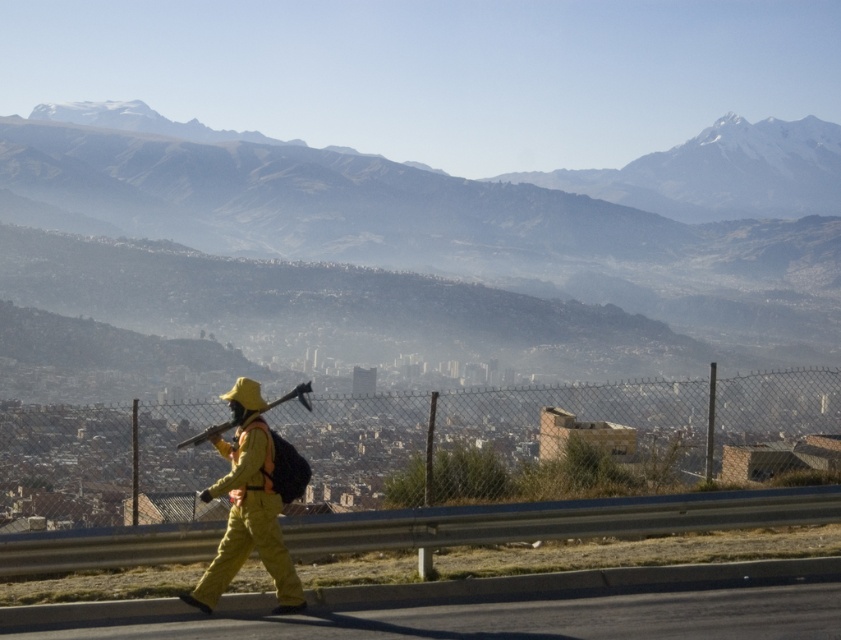
Question: Is black asphalt highway at lower center positioned behind matte black ax at center?

Choices:
 (A) yes
 (B) no

Answer: (B)

Question: Which point appears farthest from the camera in this image?

Choices:
 (A) (213, 570)
 (B) (648, 625)
 (C) (295, 394)

Answer: (C)

Question: Which of these objects is positioned closest to the black asphalt highway at lower center?

Choices:
 (A) matte black ax at center
 (B) yellow fabric uniform at center

Answer: (B)

Question: Is yellow fabric uniform at center to the right of matte black ax at center from the viewer's perspective?

Choices:
 (A) yes
 (B) no

Answer: (A)

Question: Which point is closer to the camera?

Choices:
 (A) (242, 504)
 (B) (299, 397)

Answer: (A)

Question: Does yellow fabric uniform at center lie behind matte black ax at center?

Choices:
 (A) no
 (B) yes

Answer: (A)